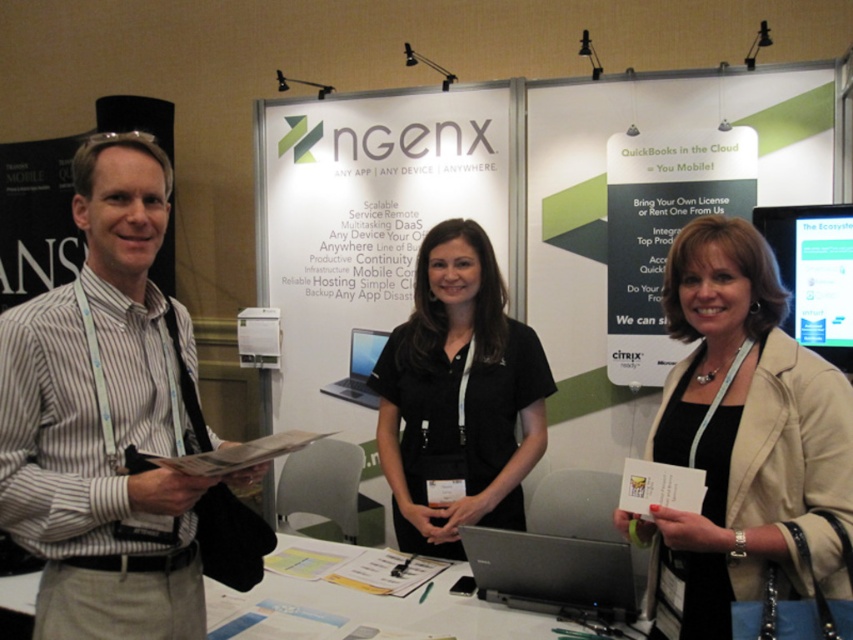
Question: Observing the image, what is the correct spatial positioning of striped cotton shirt at left in reference to black matte shirt at center?

Choices:
 (A) below
 (B) above

Answer: (B)

Question: Among these objects, which one is farthest from the camera?

Choices:
 (A) silver metallic laptop at center
 (B) black leather jacket at center
 (C) striped cotton shirt at left
 (D) slate gray laptop at center

Answer: (A)

Question: From the image, what is the correct spatial relationship of striped cotton shirt at left in relation to white paperboard at center?

Choices:
 (A) right
 (B) left

Answer: (B)

Question: Which point appears farthest from the camera in this image?

Choices:
 (A) (483, 368)
 (B) (265, 593)
 (C) (840, 420)

Answer: (A)

Question: From the image, what is the correct spatial relationship of white paperboard at center in relation to black matte shirt at center?

Choices:
 (A) left
 (B) right

Answer: (A)

Question: Which of the following is the farthest from the observer?

Choices:
 (A) (840, 352)
 (B) (682, 285)
 (C) (115, 561)
 (D) (437, 241)

Answer: (A)